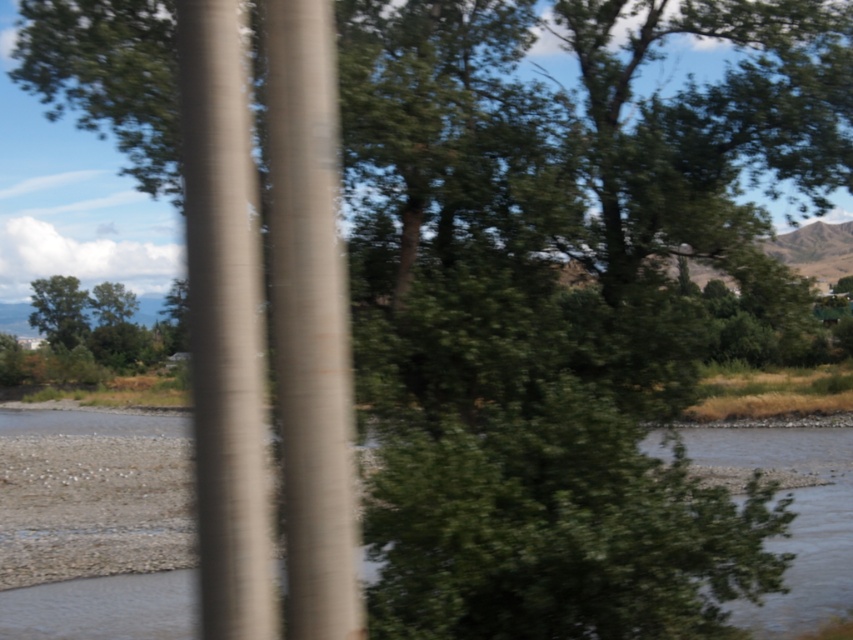
Based on the photo, you are hiking along a river path and notice a smooth brown pole at center and a green leafy tree at left. Which object is closer to the ground?

The smooth brown pole at center is below green leafy tree at left, so it is closer to the ground.

You are standing in the valley and want to take a photo of the green leafy tree at left without the smooth brown pole at center blocking it. What should you do?

The smooth brown pole at center is in front of the green leafy tree at left, so you should move to a different position to avoid the pole blocking the view of the tree.